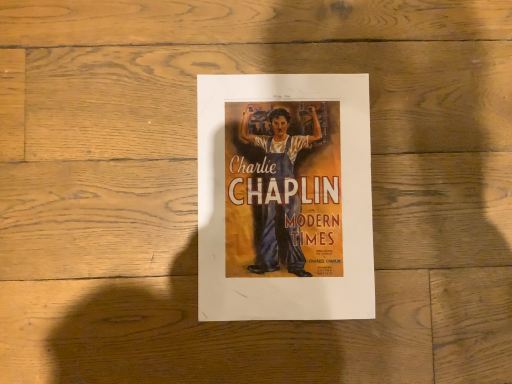
Identify the location of free space above matte paper poster at center (from a real-world perspective). (281, 191).